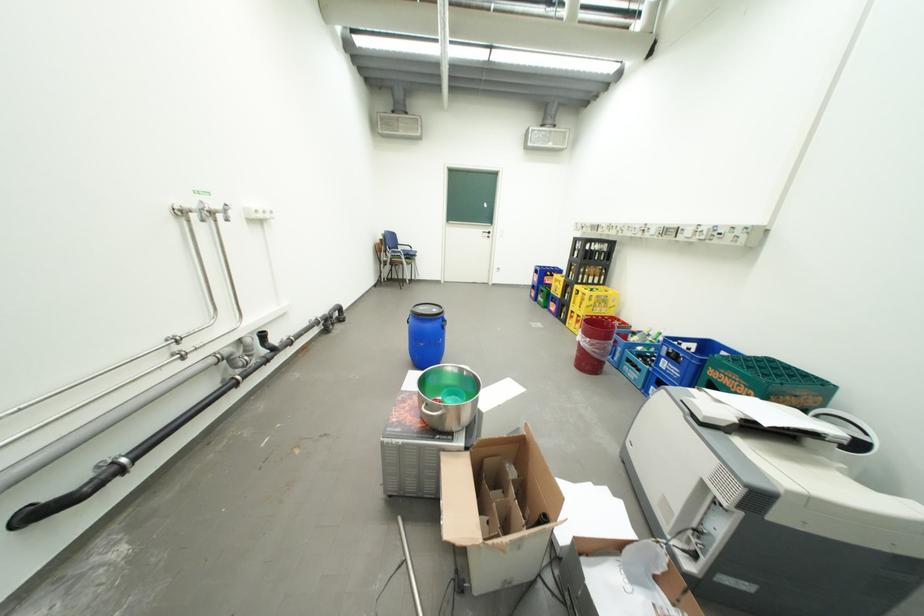
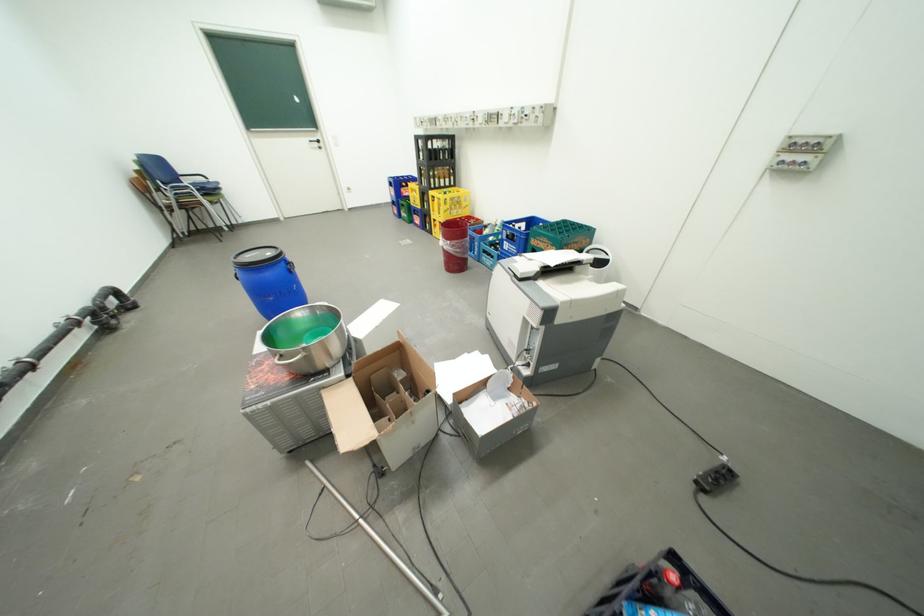
Where in the second image is the point corresponding to point (683, 376) from the first image?

(523, 253)